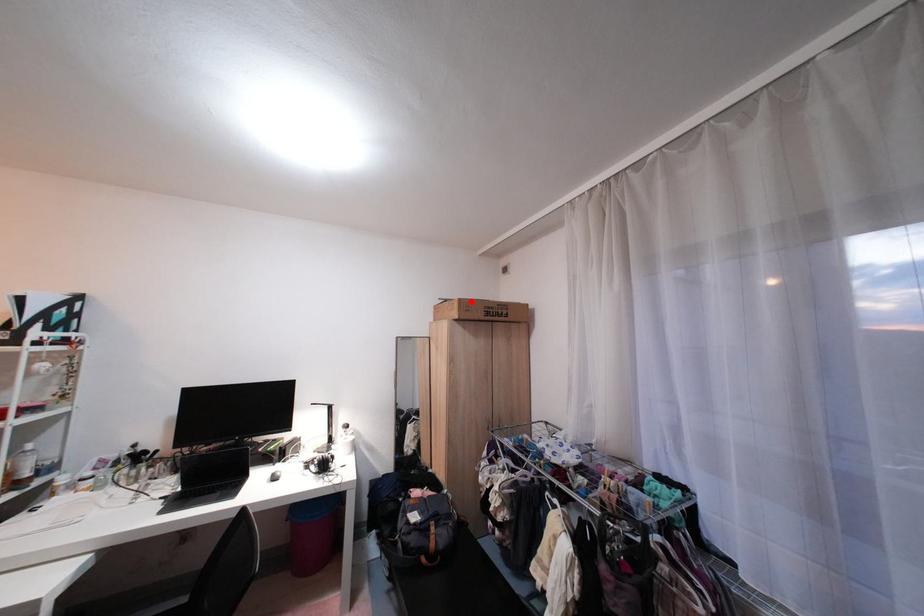
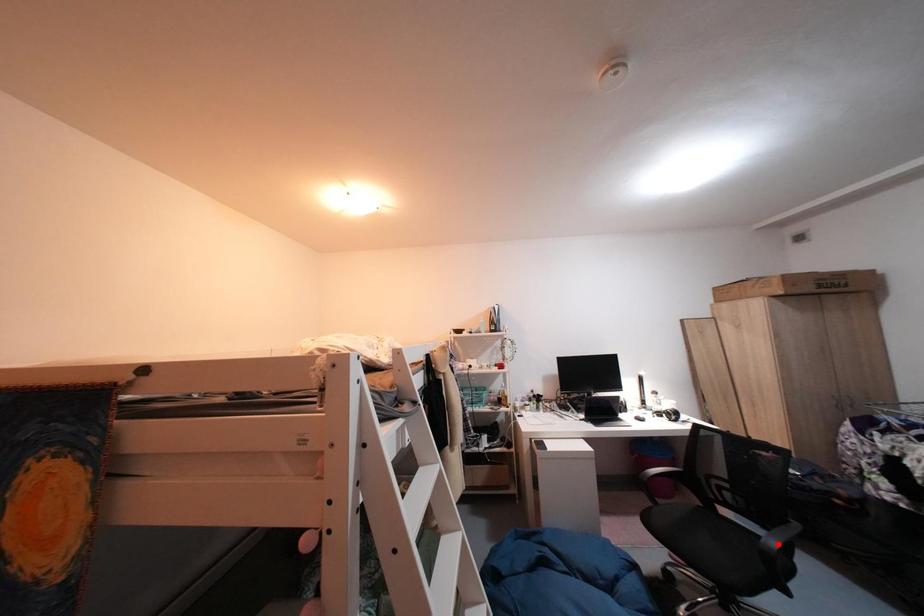
I am providing you with two images of the same scene from different viewpoints. A red point is marked on the first image and another point is marked on the second image. Do the highlighted points in image1 and image2 indicate the same real-world spot?

No